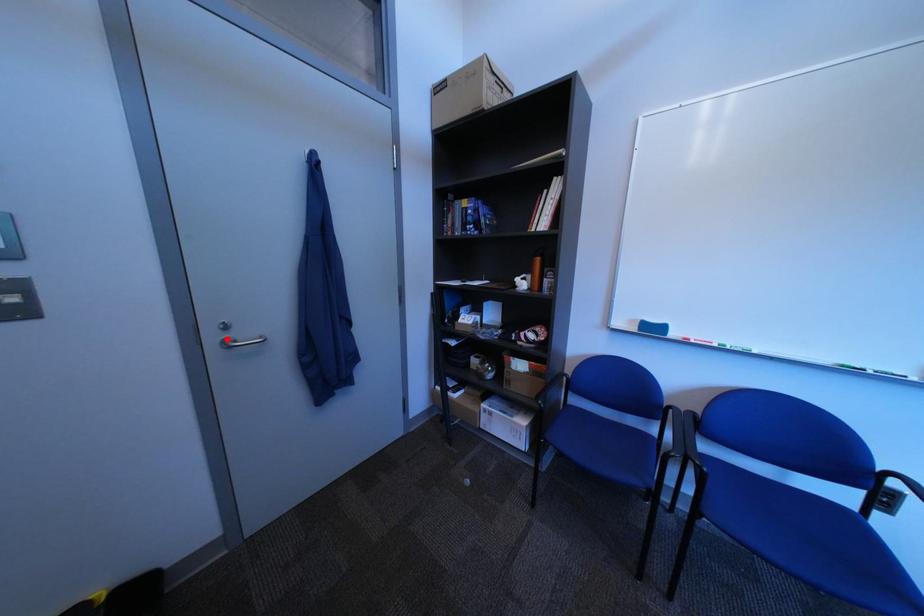
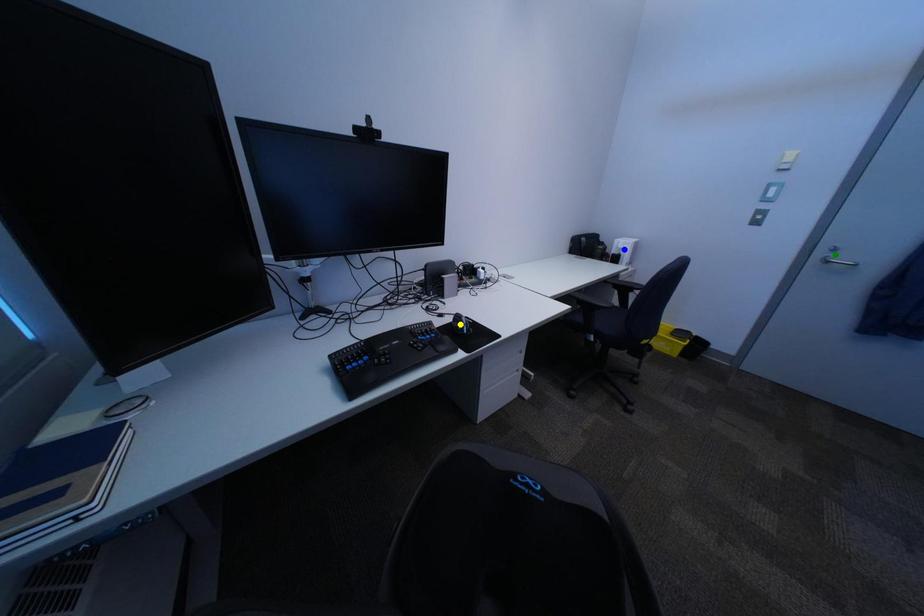
Question: I am providing you with two images of the same scene from different viewpoints. A red point is marked on the first image. You are given multiple points on the second image. Which spot in image 2 lines up with the point in image 1?

Choices:
 (A) green point
 (B) blue point
 (C) yellow point

Answer: (A)